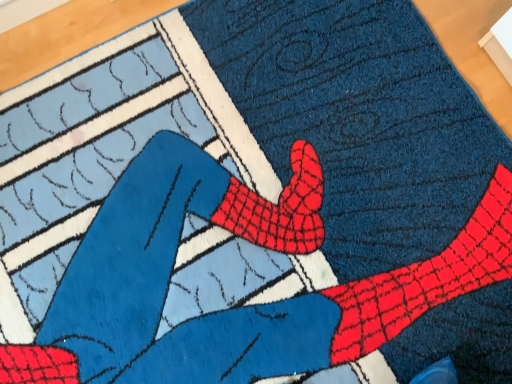
In order to face red spiderweb-patterned socks at center, should I rotate leftwards or rightwards?

Rotate right and turn 0.054 degrees.

Where is `red spiderweb-patterned socks at center`? The image size is (512, 384). red spiderweb-patterned socks at center is located at coordinates (237, 307).

What do you see at coordinates (237, 307) in the screenshot? I see `red spiderweb-patterned socks at center` at bounding box center [237, 307].

Where is `red spiderweb-patterned socks at center`? This screenshot has width=512, height=384. red spiderweb-patterned socks at center is located at coordinates (237, 307).